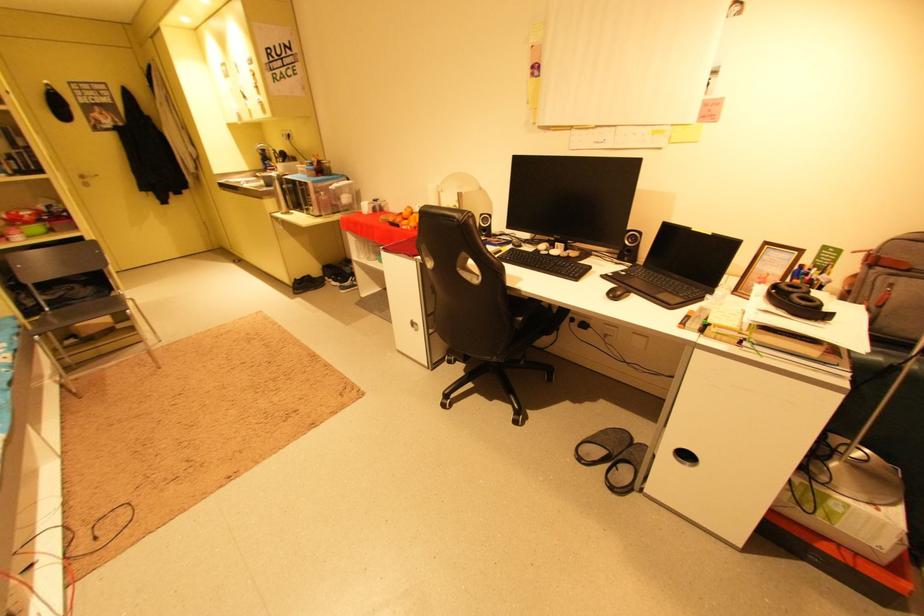
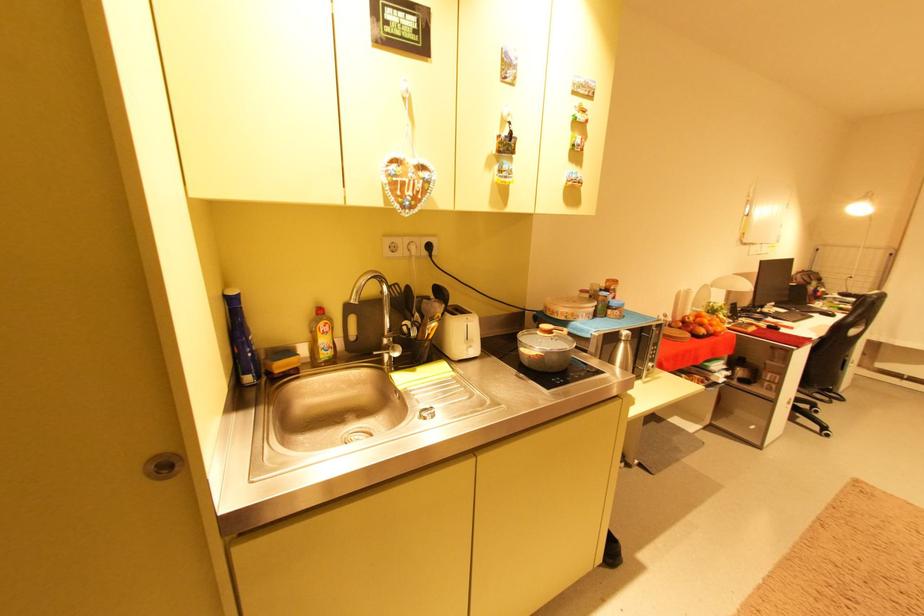
Locate, in the second image, the point that corresponds to [419,328] in the first image.

(796, 407)